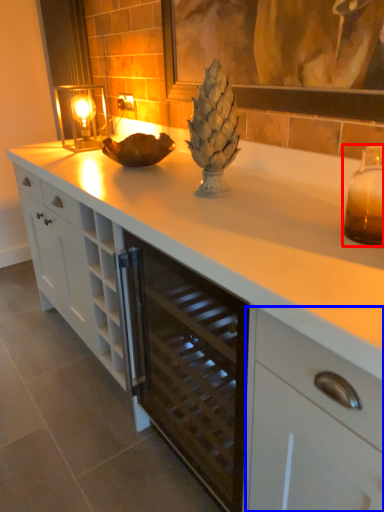
Question: Which object appears closest to the camera in this image, candle holder (highlighted by a red box) or cabinetry (highlighted by a blue box)?

Choices:
 (A) candle holder
 (B) cabinetry

Answer: (B)